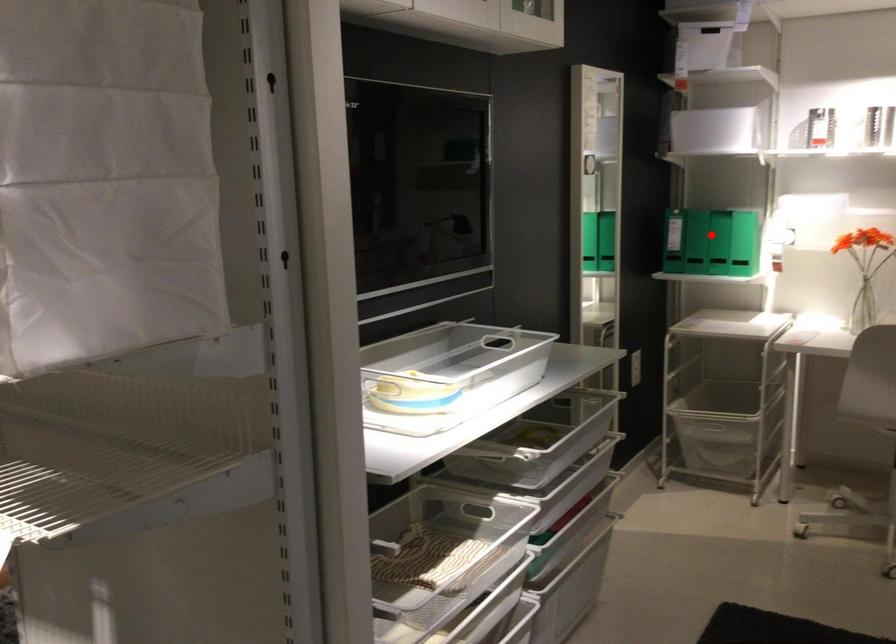
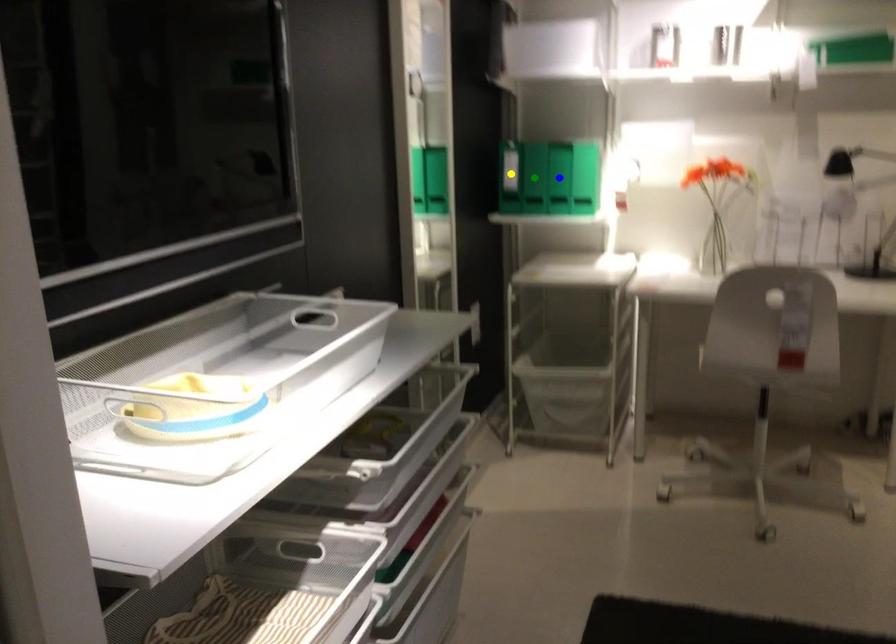
Question: I am providing you with two images of the same scene from different viewpoints. A red point is marked on the first image. You are given multiple points on the second image. Which mark in image 2 goes with the point in image 1?

Choices:
 (A) blue point
 (B) yellow point
 (C) green point

Answer: (C)